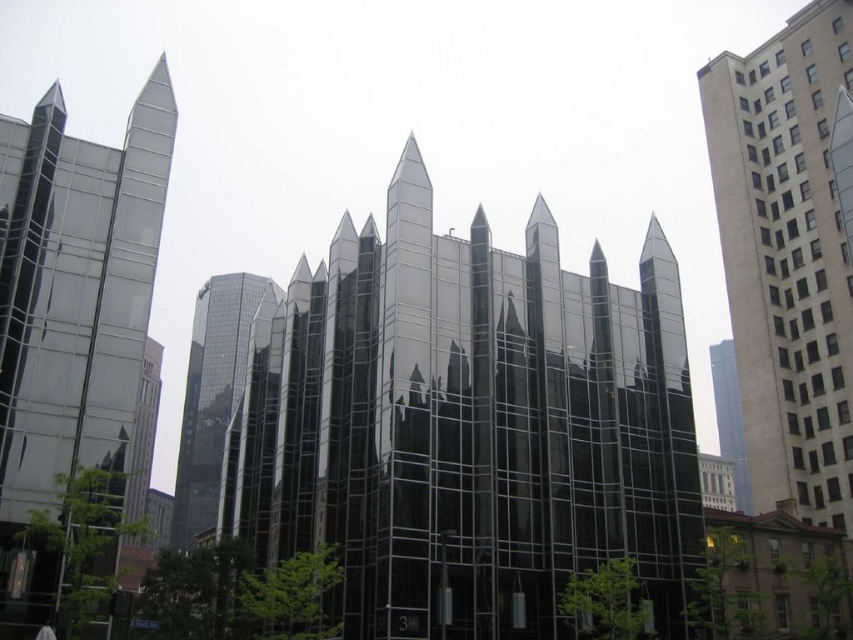
Question: Which of these objects is positioned farthest from the beige concrete building at right?

Choices:
 (A) shiny glass building at center
 (B) polished glass skyscraper at left
 (C) glossy glass tower at center

Answer: (C)

Question: Which object appears farthest from the camera in this image?

Choices:
 (A) glossy glass tower at center
 (B) beige concrete building at right
 (C) shiny glass building at center

Answer: (A)

Question: Which point appears closest to the camera in this image?

Choices:
 (A) (799, 513)
 (B) (258, 445)
 (C) (44, 444)

Answer: (C)

Question: Is beige concrete building at right above glossy glass tower at center?

Choices:
 (A) no
 (B) yes

Answer: (B)

Question: Can you confirm if polished glass skyscraper at left is wider than beige concrete building at right?

Choices:
 (A) yes
 (B) no

Answer: (B)

Question: Is polished glass skyscraper at left smaller than glossy glass tower at center?

Choices:
 (A) no
 (B) yes

Answer: (B)